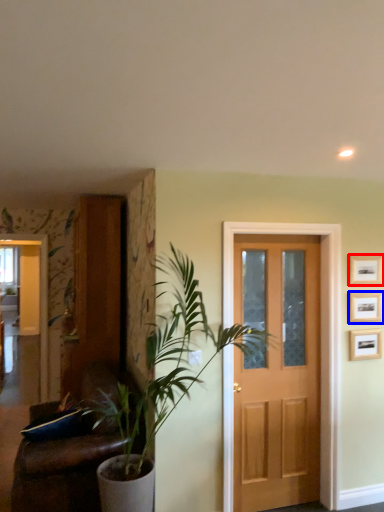
Question: Which point is closer to the camera, picture frame (highlighted by a red box) or picture frame (highlighted by a blue box)?

Choices:
 (A) picture frame
 (B) picture frame

Answer: (A)